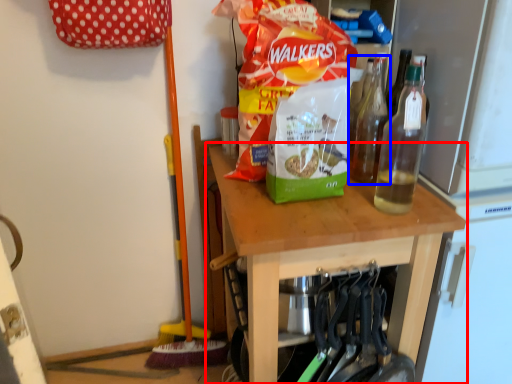
Question: Which of the following is the closest to the observer, table (highlighted by a red box) or bottle (highlighted by a blue box)?

Choices:
 (A) table
 (B) bottle

Answer: (A)